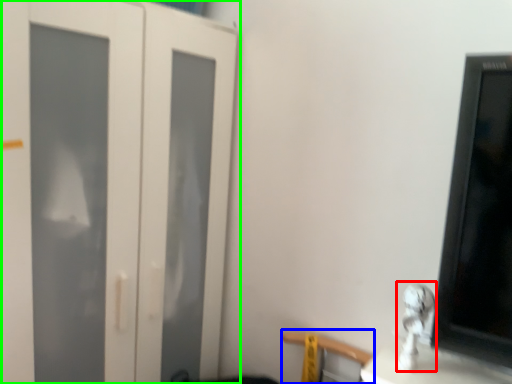
Question: Which object is the closest to the silver (highlighted by a red box)? Choose among these: chair (highlighted by a blue box) or door (highlighted by a green box).

Choices:
 (A) chair
 (B) door

Answer: (A)